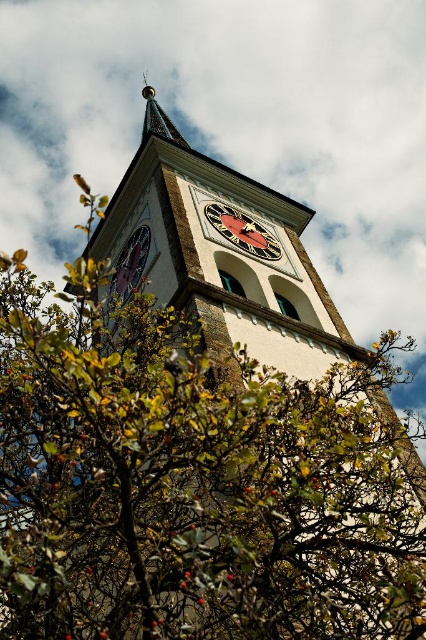
Question: Which point is closer to the camera?

Choices:
 (A) matte purple clock at center
 (B) green leafy bush at lower center
 (C) metallic clock face at center
 (D) gold metallic spire at upper center

Answer: (B)

Question: Which point appears closest to the camera in this image?

Choices:
 (A) (227, 218)
 (B) (161, 132)

Answer: (A)

Question: Can you confirm if green leafy bush at lower center is thinner than matte purple clock at center?

Choices:
 (A) yes
 (B) no

Answer: (B)

Question: Which object is the farthest from the gold metallic spire at upper center?

Choices:
 (A) matte purple clock at center
 (B) green leafy bush at lower center
 (C) metallic clock face at center

Answer: (B)

Question: Is metallic clock face at center wider than matte purple clock at center?

Choices:
 (A) yes
 (B) no

Answer: (A)

Question: Does metallic clock face at center have a greater width compared to gold metallic spire at upper center?

Choices:
 (A) no
 (B) yes

Answer: (A)